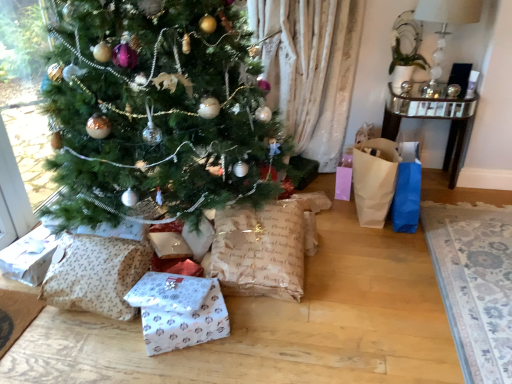
You are a GUI agent. You are given a task and a screenshot of the screen. Output one action in this format:
    pyautogui.click(x=<x>, y=<y>)
    Task: Click on the free point above white paper gift at lower center (from a real-world perspective)
    The width and height of the screenshot is (512, 384).
    Given the screenshot: What is the action you would take?
    pyautogui.click(x=183, y=314)